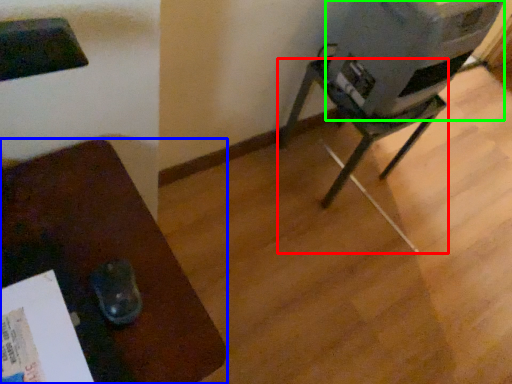
Question: Considering the real-world distances, which object is closest to furniture (highlighted by a red box)? furniture (highlighted by a blue box) or water cooler (highlighted by a green box).

Choices:
 (A) furniture
 (B) water cooler

Answer: (B)